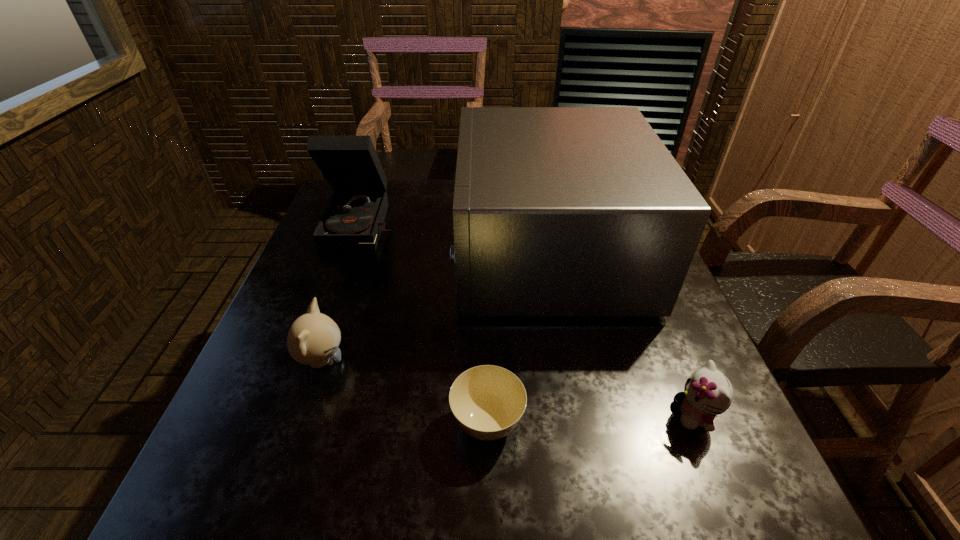
At what (x,y) coordinates should I click in order to perform the action: click on vacant space located on the face of the third nearest object. Please return your answer as a coordinate pair (x, y). The height and width of the screenshot is (540, 960). Looking at the image, I should click on (381, 361).

Where is `free space located on the front-facing side of the right kitten`? This screenshot has height=540, width=960. free space located on the front-facing side of the right kitten is located at coordinates (612, 415).

Find the location of `vacant space located on the front-facing side of the right kitten`. vacant space located on the front-facing side of the right kitten is located at coordinates (506, 415).

The image size is (960, 540). Find the location of `blank area located 0.390m on the front-facing side of the right kitten`. blank area located 0.390m on the front-facing side of the right kitten is located at coordinates (456, 415).

Find the location of a particular element. This screenshot has height=540, width=960. vacant region located on the right of the sugar bowl is located at coordinates (614, 423).

Where is `microwave oven that is at the far edge`? This screenshot has width=960, height=540. microwave oven that is at the far edge is located at coordinates (558, 211).

The image size is (960, 540). Find the location of `phonograph_record situated at the far edge`. phonograph_record situated at the far edge is located at coordinates (354, 217).

At what (x,y) coordinates should I click in order to perform the action: click on phonograph_record that is at the left edge. Please return your answer as a coordinate pair (x, y). Looking at the image, I should click on (354, 217).

What are the coordinates of `kitten that is positioned at the left edge` in the screenshot? It's located at tap(313, 339).

The width and height of the screenshot is (960, 540). Identify the location of microwave oven present at the right edge. (558, 211).